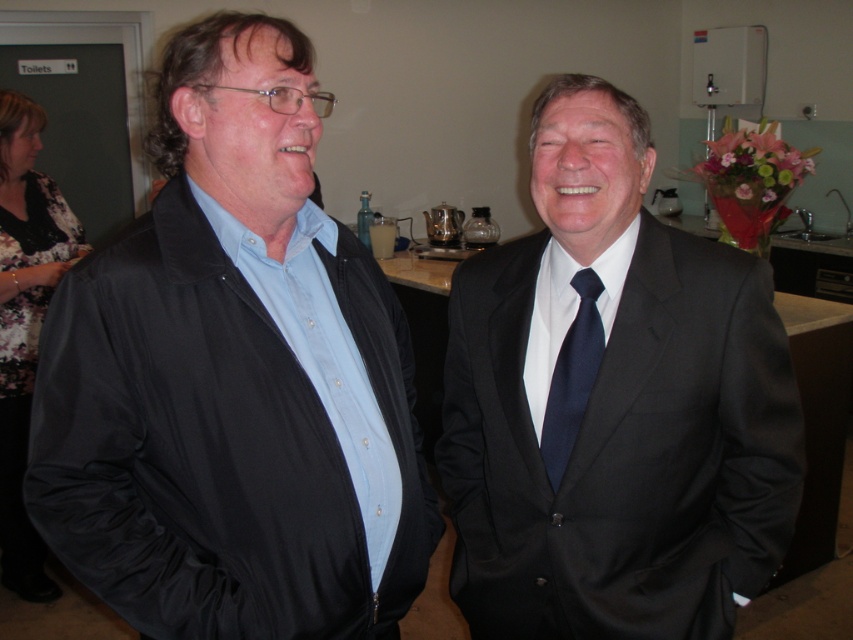
Question: Is floral print fabric dress at left smaller than navy blue silk tie at center?

Choices:
 (A) no
 (B) yes

Answer: (A)

Question: Does floral print fabric dress at left have a greater width compared to navy blue silk tie at center?

Choices:
 (A) yes
 (B) no

Answer: (A)

Question: Which object appears closest to the camera in this image?

Choices:
 (A) matte black jacket at left
 (B) satin black suit at right

Answer: (A)

Question: Among these points, which one is nearest to the camera?

Choices:
 (A) (164, 616)
 (B) (9, 509)
 (C) (621, 467)

Answer: (A)

Question: Which object appears farthest from the camera in this image?

Choices:
 (A) navy blue silk tie at center
 (B) matte black jacket at left
 (C) satin black suit at right

Answer: (A)

Question: Can you confirm if satin black suit at right is smaller than floral print fabric dress at left?

Choices:
 (A) yes
 (B) no

Answer: (A)